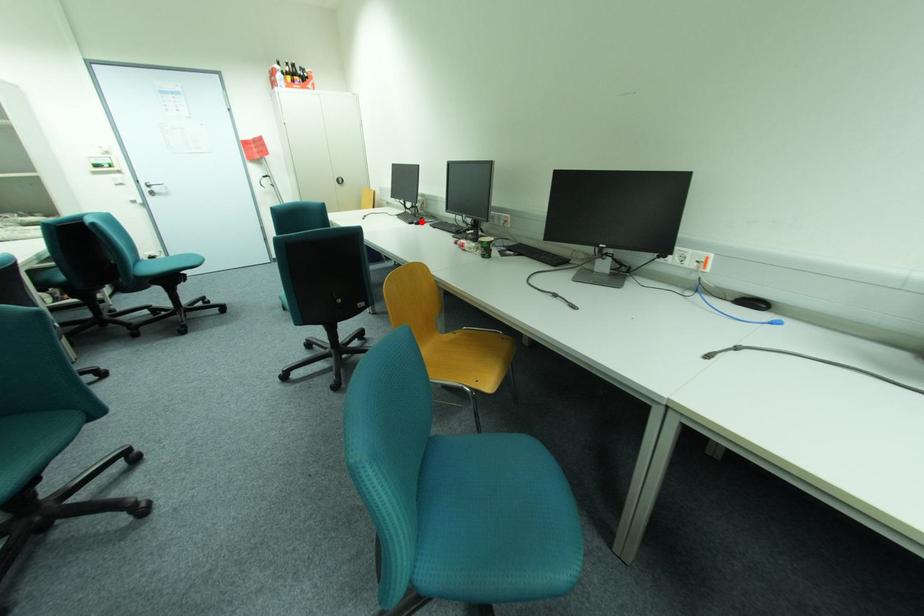
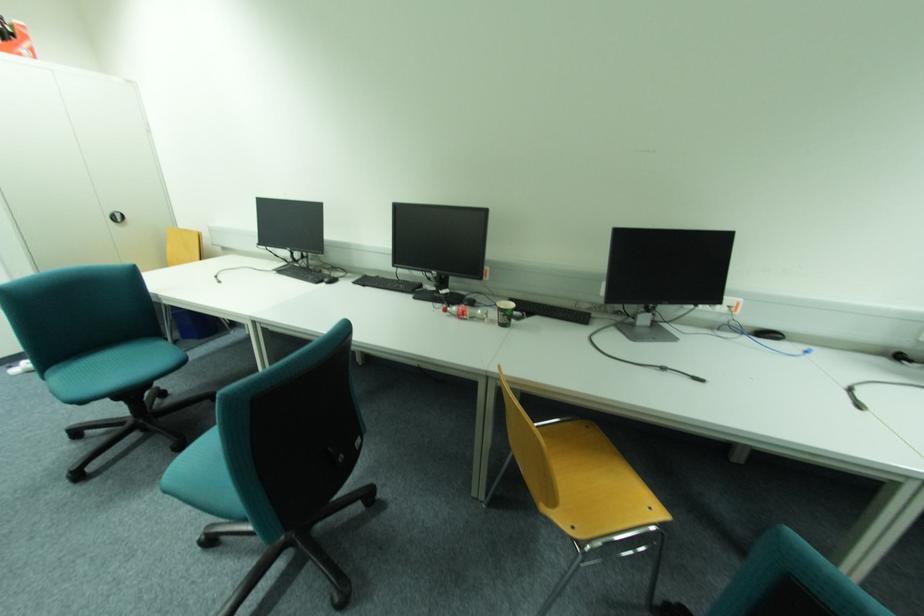
Where in the second image is the point corresponding to the highlighted location from the first image?

(333, 280)